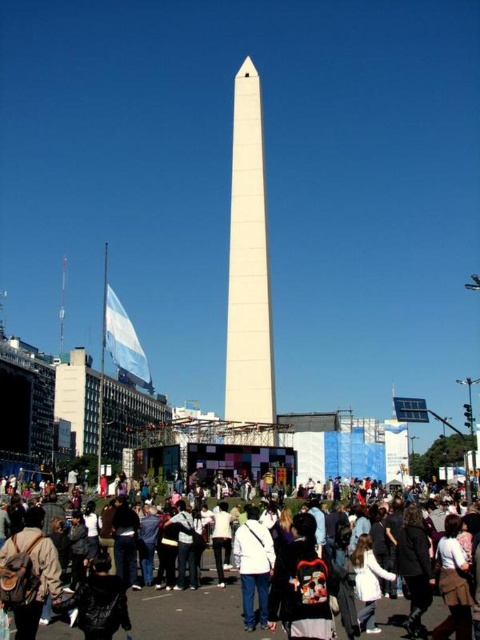
Question: Which of the following is the closest to the observer?

Choices:
 (A) matte black backpacks at lower center
 (B) white smooth obelisk at center
 (C) white matte jacket at center

Answer: (A)

Question: Can you confirm if matte black backpacks at lower center is wider than white matte jacket at center?

Choices:
 (A) no
 (B) yes

Answer: (B)

Question: Which point is farther from the camera taking this photo?

Choices:
 (A) (239, 552)
 (B) (233, 388)
 (C) (156, 600)

Answer: (B)

Question: Is matte black backpacks at lower center below white matte jacket at center?

Choices:
 (A) yes
 (B) no

Answer: (A)

Question: Does matte black backpacks at lower center appear over white matte jacket at center?

Choices:
 (A) no
 (B) yes

Answer: (A)

Question: Among these objects, which one is nearest to the camera?

Choices:
 (A) white smooth obelisk at center
 (B) matte black backpacks at lower center

Answer: (B)